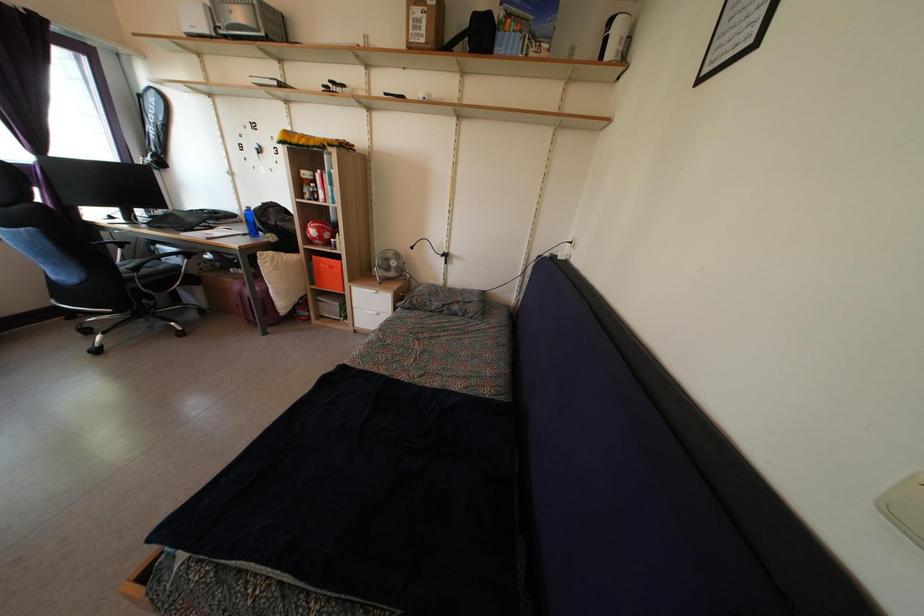
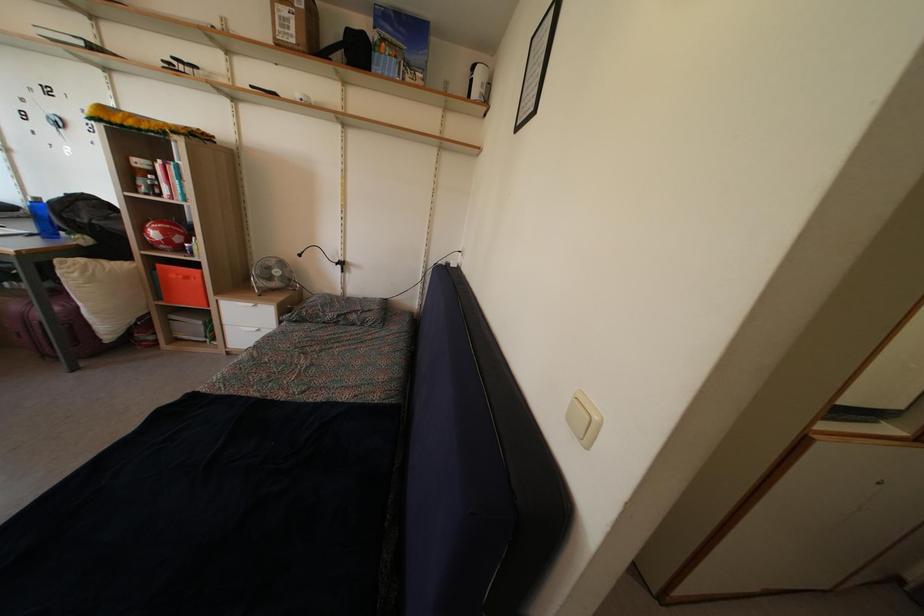
Find the pixel in the second image that matches [315,241] in the first image.

(157, 243)